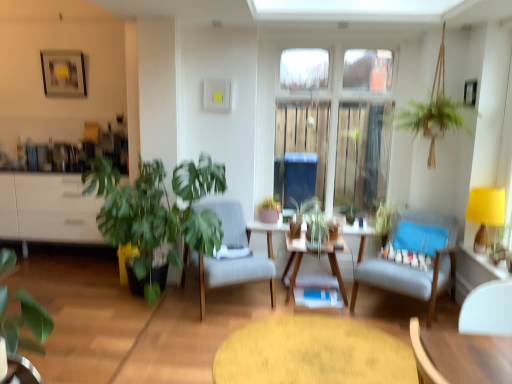
Question: From the image's perspective, is green matte plant at lower left, the third houseplant positioned from the right, positioned above or below matte pink pot at center, the third houseplant positioned from the left?

Choices:
 (A) below
 (B) above

Answer: (A)

Question: Is green matte plant at lower left, positioned as the 3th houseplant in back-to-front order, in front of or behind matte pink pot at center, the third houseplant positioned from the left, in the image?

Choices:
 (A) behind
 (B) front

Answer: (B)

Question: Considering the real-world distances, which object is closest to the clear glass window at center?

Choices:
 (A) green matte plant at lower left, which appears as the 1th houseplant when viewed from the left
 (B) matte black picture frame at upper left
 (C) yellow fabric lampshade at right
 (D) light blue fabric chair at center right, which appears as the second chair when viewed from the left
 (E) wooden round table at center

Answer: (D)

Question: Estimate the real-world distances between objects in this image. Which object is farther from the light gray fabric chair at center, the first chair when ordered from left to right?

Choices:
 (A) wooden table at center, positioned as the 2th table in front-to-back order
 (B) matte pink pot at center, marked as the 1th houseplant in a back-to-front arrangement
 (C) green leafy plant at left, marked as the 2th houseplant in a left-to-right arrangement
 (D) matte black picture frame at upper left
 (E) wooden round table at center

Answer: (D)